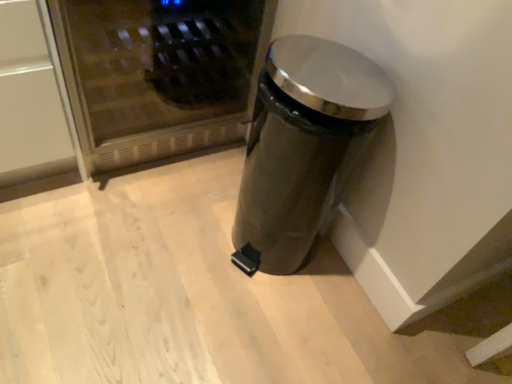
The width and height of the screenshot is (512, 384). I want to click on space that is in front of satin silver trash can at lower right, so click(253, 324).